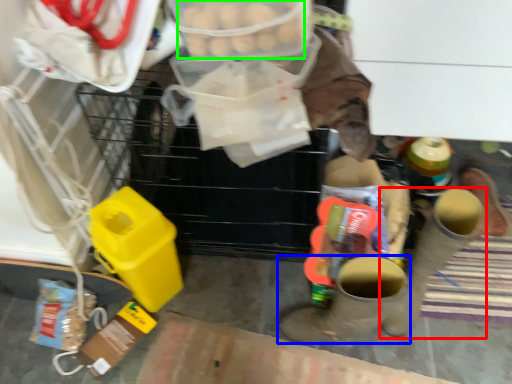
Question: Which object is the closest to the footwear (highlighted by a red box)? Choose among these: footwear (highlighted by a blue box) or food (highlighted by a green box).

Choices:
 (A) footwear
 (B) food

Answer: (A)